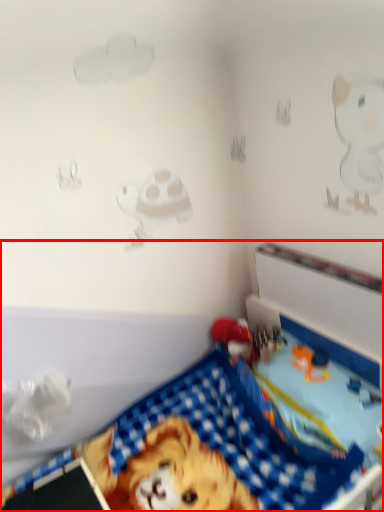
Question: Considering the relative positions of toy (annotated by the red box) and toy in the image provided, where is toy (annotated by the red box) located with respect to the staircase?

Choices:
 (A) left
 (B) right

Answer: (A)